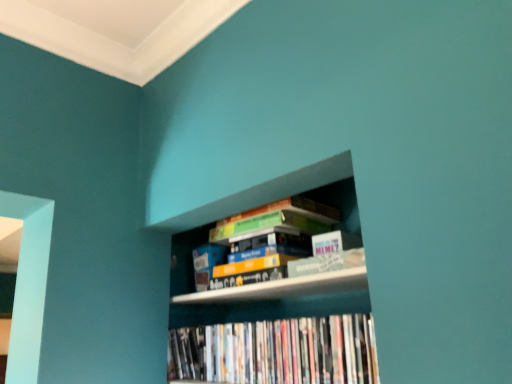
Question: Considering their positions, is hardcover books at upper center, the first book in the top-to-bottom sequence, located in front of or behind white glossy dvds at lower center, which ranks as the first book in bottom-to-top order?

Choices:
 (A) front
 (B) behind

Answer: (B)

Question: From a real-world perspective, is hardcover books at upper center, the second book in the bottom-to-top sequence, positioned above or below white glossy dvds at lower center, which ranks as the 2th book in top-to-bottom order?

Choices:
 (A) above
 (B) below

Answer: (A)

Question: Which of these objects is positioned farthest from the wooden bookshelf at center?

Choices:
 (A) hardcover books at upper center, the second book in the bottom-to-top sequence
 (B) white glossy dvds at lower center, which ranks as the 2th book in top-to-bottom order

Answer: (A)

Question: Which object is positioned farthest from the hardcover books at upper center, the first book in the top-to-bottom sequence?

Choices:
 (A) wooden bookshelf at center
 (B) white glossy dvds at lower center, which ranks as the 2th book in top-to-bottom order

Answer: (B)